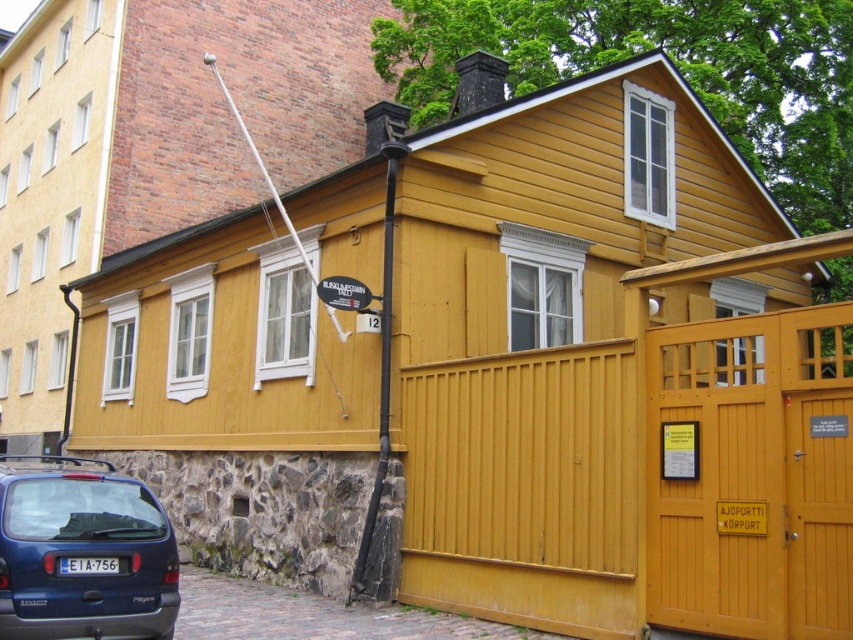
You are standing in front of a yellow wooden house with a black roof. You see a point marked at coordinates (82, 552). What object is located at this point?

The point at coordinates (82, 552) corresponds to the matte blue hatchback at lower left.

You are standing in front of the yellow wooden house and want to park your car between the matte blue hatchback at lower left and the black metal pole at center. Is there enough space for your car to fit between them?

The matte blue hatchback at lower left is to the left of the black metal pole at center, so there is space between them for your car to park.